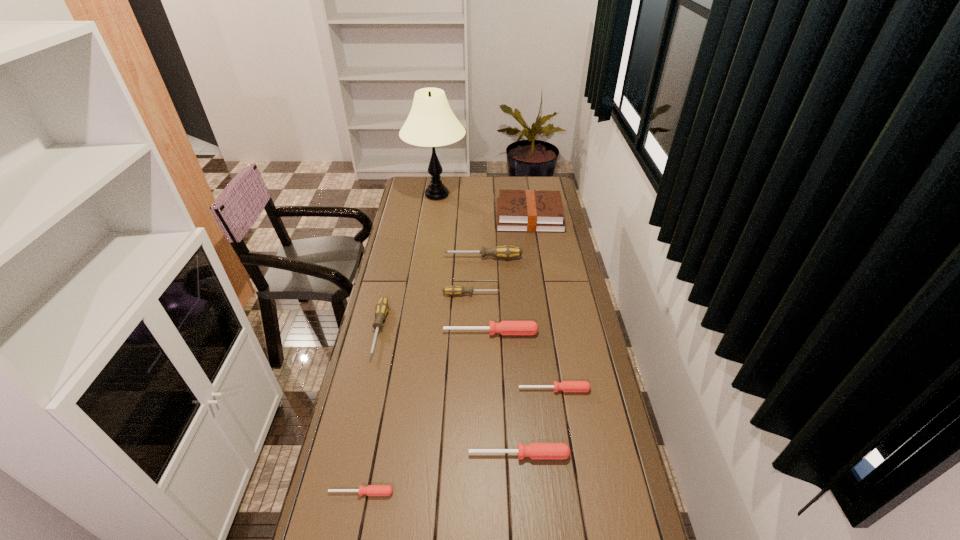
The height and width of the screenshot is (540, 960). I want to click on the tallest object, so click(x=431, y=123).

You are a GUI agent. You are given a task and a screenshot of the screen. Output one action in this format:
    pyautogui.click(x=<x>, y=<y>)
    Task: Click on the black lamp
    
    Given the screenshot: What is the action you would take?
    pyautogui.click(x=431, y=123)

You are a GUI agent. You are given a task and a screenshot of the screen. Output one action in this format:
    pyautogui.click(x=<x>, y=<y>)
    Task: Click on the hardback book
    Image resolution: width=960 pixels, height=540 pixels.
    Given the screenshot: What is the action you would take?
    pyautogui.click(x=517, y=210)

In order to click on the farthest gray screwdriver in this screenshot , I will do `click(507, 251)`.

At what (x,y) coordinates should I click in order to perform the action: click on the farthest screwdriver. Please return your answer as a coordinate pair (x, y). Image resolution: width=960 pixels, height=540 pixels. Looking at the image, I should click on (507, 251).

At what (x,y) coordinates should I click in order to perform the action: click on the nearest gray screwdriver. Please return your answer as a coordinate pair (x, y). Image resolution: width=960 pixels, height=540 pixels. Looking at the image, I should click on (382, 307).

This screenshot has width=960, height=540. Identify the location of the second smallest gray screwdriver. (382, 307).

In order to click on the biggest red screwdriver in this screenshot , I will do `click(504, 327)`.

At what (x,y) coordinates should I click in order to perform the action: click on the sixth nearest screwdriver. Please return your answer as a coordinate pair (x, y). The width and height of the screenshot is (960, 540). Looking at the image, I should click on (453, 290).

The height and width of the screenshot is (540, 960). In order to click on the second nearest gray screwdriver in this screenshot , I will do `click(453, 290)`.